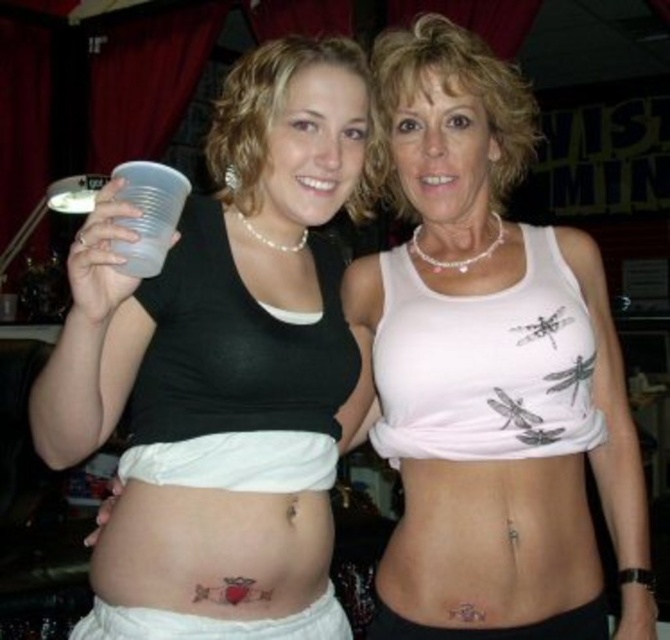
Who is taller, black matte tank top at center or white fabric at lower center?

With more height is black matte tank top at center.

Is black matte tank top at center bigger than white fabric at lower center?

Yes, black matte tank top at center is bigger than white fabric at lower center.

Between point (277, 109) and point (137, 632), which one is positioned in front?

Point (137, 632)

This screenshot has width=670, height=640. I want to click on black matte tank top at center, so click(222, 365).

Between white matte tank top at center and white matte bikini top at center, which one is positioned higher?

Positioned higher is white matte tank top at center.

Identify the location of white matte tank top at center. The width and height of the screenshot is (670, 640). (490, 371).

Where is `white matte tank top at center`? Image resolution: width=670 pixels, height=640 pixels. white matte tank top at center is located at coordinates (490, 371).

Which is behind, point (517, 385) or point (145, 620)?

Positioned behind is point (517, 385).

Between point (444, 397) and point (109, 614), which one is positioned in front?

Point (109, 614) is in front.

Does point (458, 358) come closer to viewer compared to point (310, 621)?

Yes, point (458, 358) is in front of point (310, 621).

I want to click on white matte tank top at center, so click(x=490, y=371).